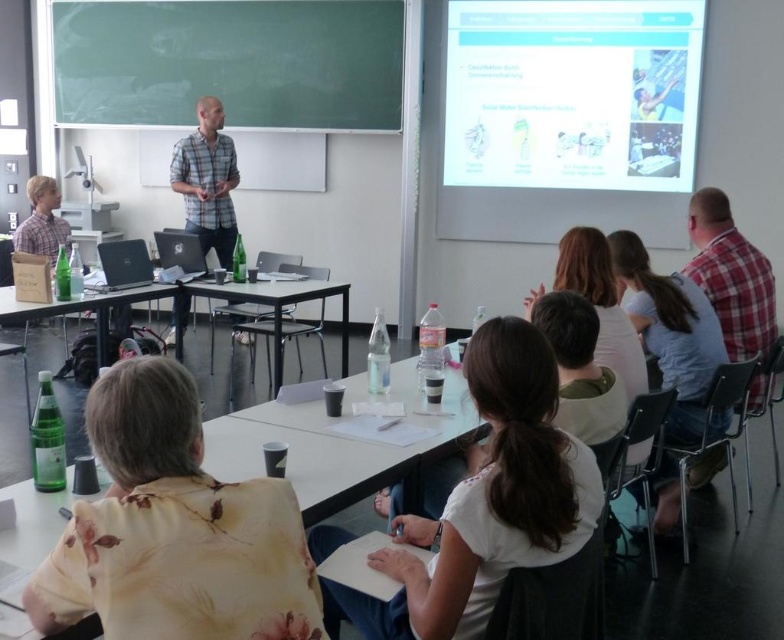
Does point (213, 182) come behind point (253, 291)?

Yes.

Who is more distant from viewer, (205,218) or (278,321)?

The point (205,218) is behind.

Find the location of `plaid cotton shirt at center`. plaid cotton shirt at center is located at coordinates click(x=207, y=180).

Is point (196, 161) closer to viewer compared to point (100, 310)?

No, (196, 161) is further to viewer.

Describe the element at coordinates (207, 180) in the screenshot. I see `plaid cotton shirt at center` at that location.

Is point (209, 156) closer to camera compared to point (169, 291)?

That is False.

Where is `plaid cotton shirt at center`? plaid cotton shirt at center is located at coordinates (207, 180).

Who is positioned more to the right, green chalkboard at upper left or clear plastic table at lower left?

green chalkboard at upper left

Who is shorter, green chalkboard at upper left or clear plastic table at lower left?

clear plastic table at lower left

Is point (367, 52) positioned in front of point (176, 324)?

That is False.

Identify the location of green chalkboard at upper left. (230, 61).